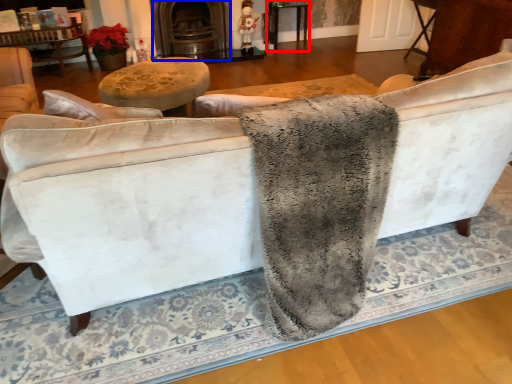
Question: Which object is further to the camera taking this photo, table (highlighted by a red box) or fireplace (highlighted by a blue box)?

Choices:
 (A) table
 (B) fireplace

Answer: (A)